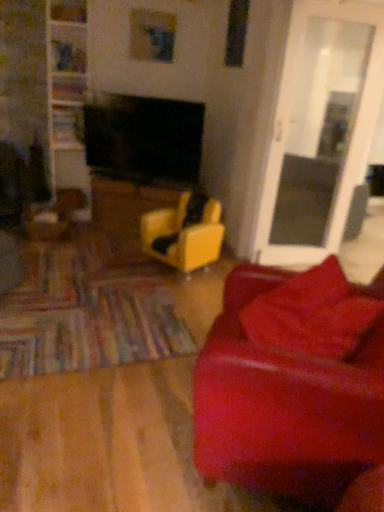
Question: From the image's perspective, is yellow leather chair at center on velvet red pillow at lower right?

Choices:
 (A) no
 (B) yes

Answer: (B)

Question: Is velvet red pillow at lower right completely or partially inside yellow leather chair at center?

Choices:
 (A) no
 (B) yes

Answer: (A)

Question: Considering the relative sizes of yellow leather chair at center and velvet red pillow at lower right in the image provided, is yellow leather chair at center bigger than velvet red pillow at lower right?

Choices:
 (A) no
 (B) yes

Answer: (B)

Question: Is yellow leather chair at center further to the viewer compared to velvet red pillow at lower right?

Choices:
 (A) no
 (B) yes

Answer: (B)

Question: Is yellow leather chair at center wider than velvet red pillow at lower right?

Choices:
 (A) yes
 (B) no

Answer: (A)

Question: From their relative heights in the image, would you say velvet red pillow at lower right is taller or shorter than yellow leather chair at center?

Choices:
 (A) tall
 (B) short

Answer: (B)

Question: From the image's perspective, relative to yellow leather chair at center, is velvet red pillow at lower right above or below?

Choices:
 (A) above
 (B) below

Answer: (B)

Question: From a real-world perspective, is velvet red pillow at lower right physically located above or below yellow leather chair at center?

Choices:
 (A) below
 (B) above

Answer: (B)

Question: Considering the relative positions of velvet red pillow at lower right and yellow leather chair at center in the image provided, is velvet red pillow at lower right to the left or to the right of yellow leather chair at center?

Choices:
 (A) left
 (B) right

Answer: (B)

Question: Relative to velvet red pillow at lower right, is leather couch at right in front or behind?

Choices:
 (A) front
 (B) behind

Answer: (A)

Question: Would you say leather couch at right is to the left or to the right of velvet red pillow at lower right in the picture?

Choices:
 (A) left
 (B) right

Answer: (B)

Question: Looking at their shapes, would you say leather couch at right is wider or thinner than velvet red pillow at lower right?

Choices:
 (A) thin
 (B) wide

Answer: (B)

Question: Would you say leather couch at right is inside or outside velvet red pillow at lower right?

Choices:
 (A) inside
 (B) outside

Answer: (B)

Question: In the image, is yellow leather chair at center on the left side or the right side of yellow matte table at center?

Choices:
 (A) right
 (B) left

Answer: (A)

Question: Based on their sizes in the image, would you say yellow leather chair at center is bigger or smaller than yellow matte table at center?

Choices:
 (A) big
 (B) small

Answer: (B)